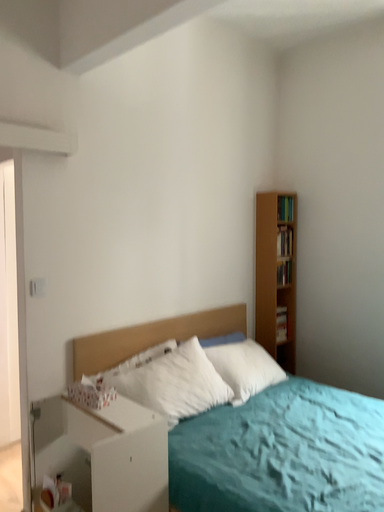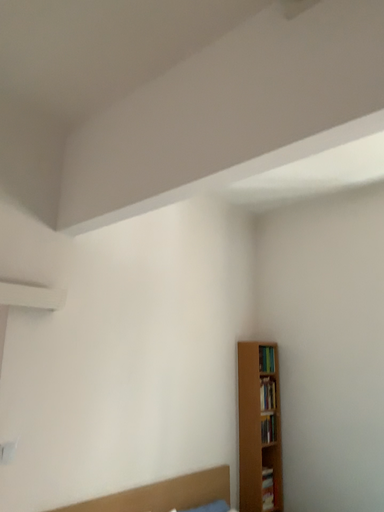
Question: How did the camera likely rotate when shooting the video?

Choices:
 (A) rotated upward
 (B) rotated downward

Answer: (A)